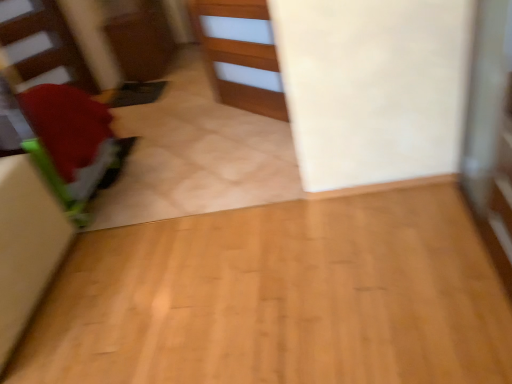
Question: Is green fabric cushion at left at the back of wooden cabinet at center?

Choices:
 (A) yes
 (B) no

Answer: (B)

Question: Is wooden cabinet at center further to the viewer compared to green fabric cushion at left?

Choices:
 (A) yes
 (B) no

Answer: (A)

Question: Is wooden cabinet at center outside green fabric cushion at left?

Choices:
 (A) yes
 (B) no

Answer: (A)

Question: Considering the relative sizes of wooden cabinet at center and green fabric cushion at left in the image provided, is wooden cabinet at center shorter than green fabric cushion at left?

Choices:
 (A) yes
 (B) no

Answer: (B)

Question: Can you confirm if wooden cabinet at center is wider than green fabric cushion at left?

Choices:
 (A) yes
 (B) no

Answer: (B)

Question: From the image's perspective, is matte red stairwell at left positioned above or below green fabric cushion at left?

Choices:
 (A) above
 (B) below

Answer: (A)

Question: Considering the relative positions of matte red stairwell at left and green fabric cushion at left in the image provided, is matte red stairwell at left to the left or to the right of green fabric cushion at left?

Choices:
 (A) left
 (B) right

Answer: (A)

Question: In terms of height, does matte red stairwell at left look taller or shorter compared to green fabric cushion at left?

Choices:
 (A) short
 (B) tall

Answer: (B)

Question: In terms of size, does matte red stairwell at left appear bigger or smaller than green fabric cushion at left?

Choices:
 (A) big
 (B) small

Answer: (B)

Question: From the image's perspective, is green fabric cushion at left positioned above or below wooden cabinet at center?

Choices:
 (A) below
 (B) above

Answer: (A)

Question: Is green fabric cushion at left spatially inside wooden cabinet at center, or outside of it?

Choices:
 (A) inside
 (B) outside

Answer: (B)

Question: From a real-world perspective, is green fabric cushion at left above or below wooden cabinet at center?

Choices:
 (A) above
 (B) below

Answer: (A)

Question: Is green fabric cushion at left bigger or smaller than wooden cabinet at center?

Choices:
 (A) small
 (B) big

Answer: (B)

Question: In terms of height, does wooden cabinet at center look taller or shorter compared to matte red stairwell at left?

Choices:
 (A) short
 (B) tall

Answer: (A)

Question: Considering the positions of wooden cabinet at center and matte red stairwell at left in the image, is wooden cabinet at center wider or thinner than matte red stairwell at left?

Choices:
 (A) wide
 (B) thin

Answer: (B)